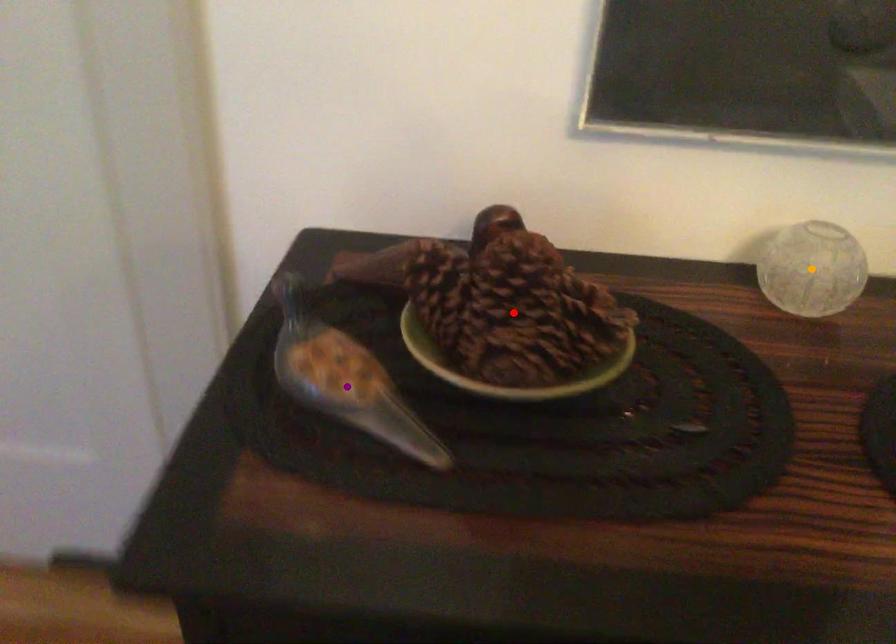
Order these from nearest to farthest:
purple point
red point
orange point

red point → purple point → orange point